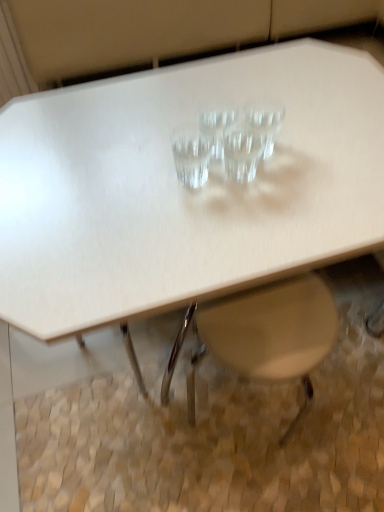
Question: Is white plastic swivel chair at lower center to the right of transparent glass martini glass at center, marked as the fourth martini glass in a right-to-left arrangement, from the viewer's perspective?

Choices:
 (A) yes
 (B) no

Answer: (A)

Question: Is white plastic swivel chair at lower center far away from transparent glass martini glass at center, marked as the fourth martini glass in a right-to-left arrangement?

Choices:
 (A) no
 (B) yes

Answer: (A)

Question: Can transparent glass martini glass at center, marked as the fourth martini glass in a right-to-left arrangement, be found inside white plastic swivel chair at lower center?

Choices:
 (A) no
 (B) yes

Answer: (A)

Question: From the image's perspective, would you say white plastic swivel chair at lower center is shown under transparent glass martini glass at center, marked as the fourth martini glass in a right-to-left arrangement?

Choices:
 (A) yes
 (B) no

Answer: (A)

Question: Can you confirm if white plastic swivel chair at lower center is wider than transparent glass martini glass at center, marked as the fourth martini glass in a right-to-left arrangement?

Choices:
 (A) yes
 (B) no

Answer: (A)

Question: Is transparent glass martini glass at center, acting as the first martini glass starting from the left, bigger or smaller than transparent glass martini glass at center, which is the second martini glass from left to right?

Choices:
 (A) big
 (B) small

Answer: (B)

Question: Considering the positions of transparent glass martini glass at center, marked as the fourth martini glass in a right-to-left arrangement, and transparent glass martini glass at center, which is the second martini glass from left to right, in the image, is transparent glass martini glass at center, marked as the fourth martini glass in a right-to-left arrangement, taller or shorter than transparent glass martini glass at center, which is the second martini glass from left to right,?

Choices:
 (A) short
 (B) tall

Answer: (A)

Question: Would you say transparent glass martini glass at center, acting as the first martini glass starting from the left, is to the left or to the right of transparent glass martini glass at center, which is the second martini glass from left to right, in the picture?

Choices:
 (A) left
 (B) right

Answer: (A)

Question: Is transparent glass martini glass at center, marked as the fourth martini glass in a right-to-left arrangement, inside or outside of transparent glass martini glass at center, placed as the third martini glass when sorted from right to left?

Choices:
 (A) inside
 (B) outside

Answer: (B)

Question: From a real-world perspective, is transparent glass martini glass at center, marked as the fourth martini glass in a right-to-left arrangement, physically located above or below transparent glass martini at center, which is the 2th martini glass from right to left?

Choices:
 (A) above
 (B) below

Answer: (A)

Question: Is transparent glass martini glass at center, marked as the fourth martini glass in a right-to-left arrangement, taller or shorter than transparent glass martini at center, which is the 2th martini glass from right to left?

Choices:
 (A) short
 (B) tall

Answer: (A)

Question: Based on their sizes in the image, would you say transparent glass martini glass at center, marked as the fourth martini glass in a right-to-left arrangement, is bigger or smaller than transparent glass martini at center, which is the 2th martini glass from right to left?

Choices:
 (A) small
 (B) big

Answer: (A)

Question: Considering the positions of point (206, 159) and point (228, 131), is point (206, 159) closer or farther from the camera than point (228, 131)?

Choices:
 (A) farther
 (B) closer

Answer: (B)

Question: Considering the positions of white plastic swivel chair at lower center and transparent glass martini glass at center, acting as the 4th martini glass starting from the left, in the image, is white plastic swivel chair at lower center bigger or smaller than transparent glass martini glass at center, acting as the 4th martini glass starting from the left,?

Choices:
 (A) big
 (B) small

Answer: (A)

Question: In terms of width, does white plastic swivel chair at lower center look wider or thinner when compared to transparent glass martini glass at center, acting as the 1th martini glass starting from the right?

Choices:
 (A) thin
 (B) wide

Answer: (B)